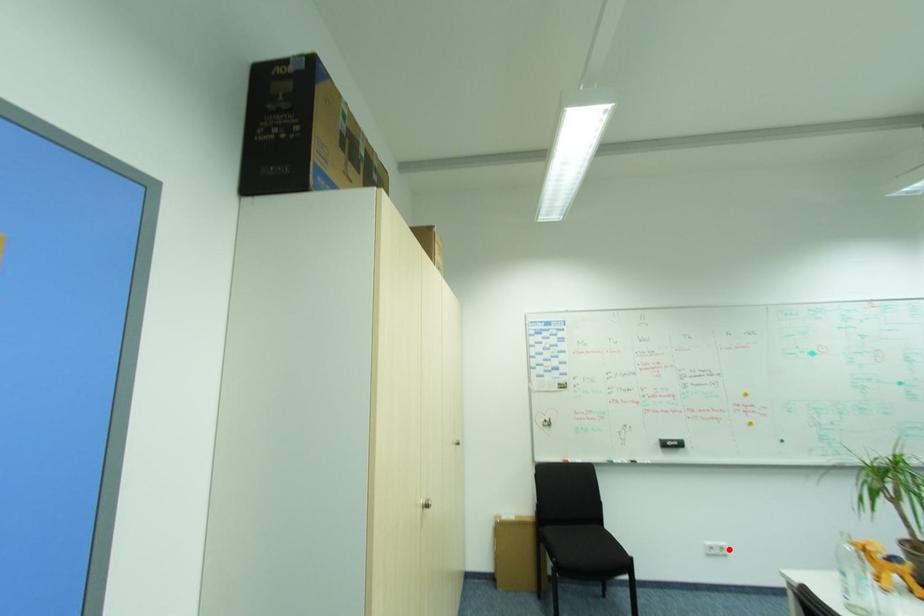
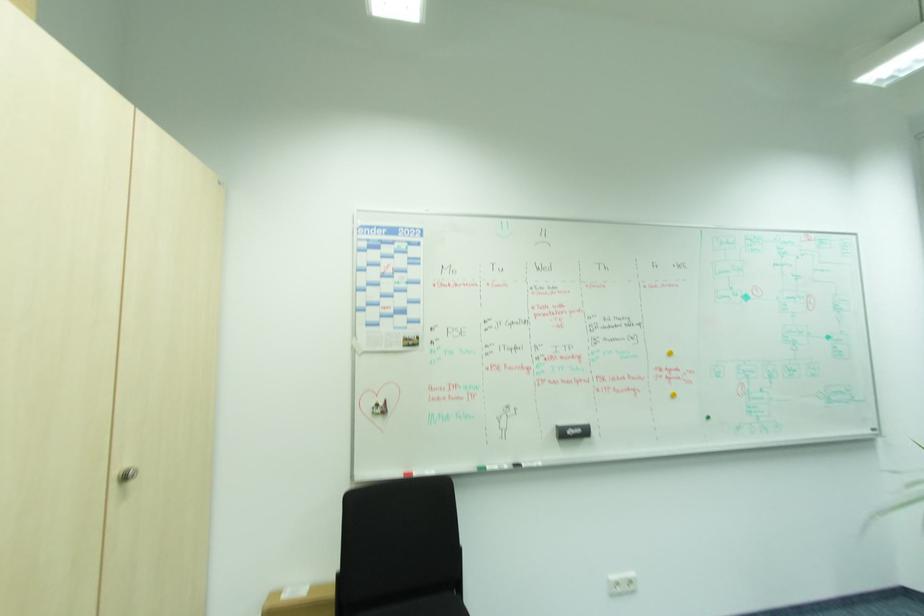
Question: I am providing you with two images of the same scene from different viewpoints. A red point is marked on the first image. At the location where the point appears in image 1, is it still visible in image 2?

Choices:
 (A) Yes
 (B) No

Answer: (A)